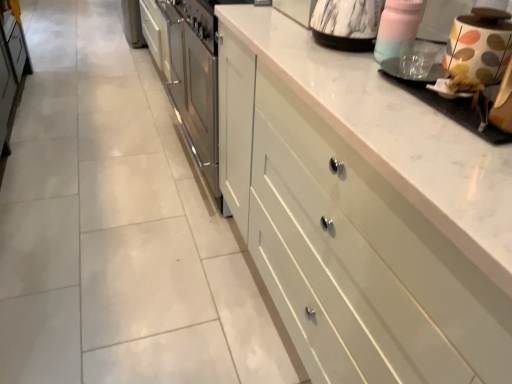
Question: Looking at the image, does white painted wood drawers at center seem bigger or smaller compared to transparent plastic cup at upper right, which is counted as the second appliance, starting from the left?

Choices:
 (A) small
 (B) big

Answer: (B)

Question: Is white painted wood drawers at center wider or thinner than transparent plastic cup at upper right, which appears as the 2th appliance when viewed from the right?

Choices:
 (A) thin
 (B) wide

Answer: (B)

Question: Based on their relative distances, which object is farther from the white painted wood drawers at center?

Choices:
 (A) marble-patterned kettle at upper right, the first appliance viewed from the left
 (B) transparent plastic cup at upper right, which is counted as the second appliance, starting from the left
 (C) white glossy coffee machine at upper right
 (D) polka dot ceramic jar at upper right, which is the 1th appliance from right to left

Answer: (A)

Question: Which of these objects is positioned farthest from the transparent plastic cup at upper right, which is counted as the second appliance, starting from the left?

Choices:
 (A) white glossy coffee machine at upper right
 (B) marble-patterned kettle at upper right, the first appliance viewed from the left
 (C) white painted wood drawers at center
 (D) polka dot ceramic jar at upper right, acting as the 3th appliance starting from the left

Answer: (C)